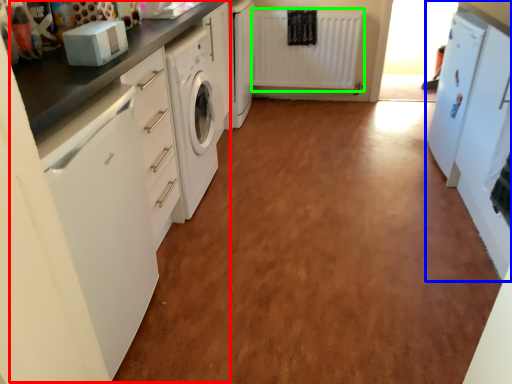
Question: Considering the real-world distances, which object is farthest from counter (highlighted by a red box)? cabinetry (highlighted by a blue box) or radiator (highlighted by a green box)?

Choices:
 (A) cabinetry
 (B) radiator

Answer: (B)